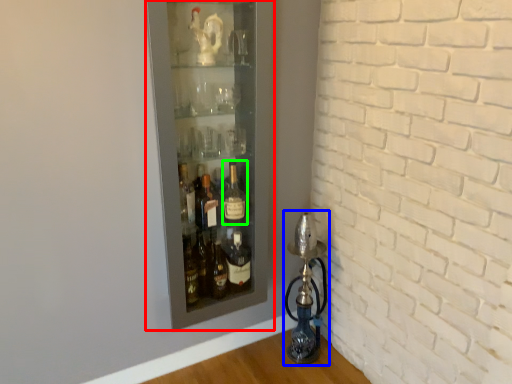
Question: Considering the real-world distances, which object is farthest from shelf (highlighted by a red box)? oil lamp (highlighted by a blue box) or bottle (highlighted by a green box)?

Choices:
 (A) oil lamp
 (B) bottle

Answer: (A)